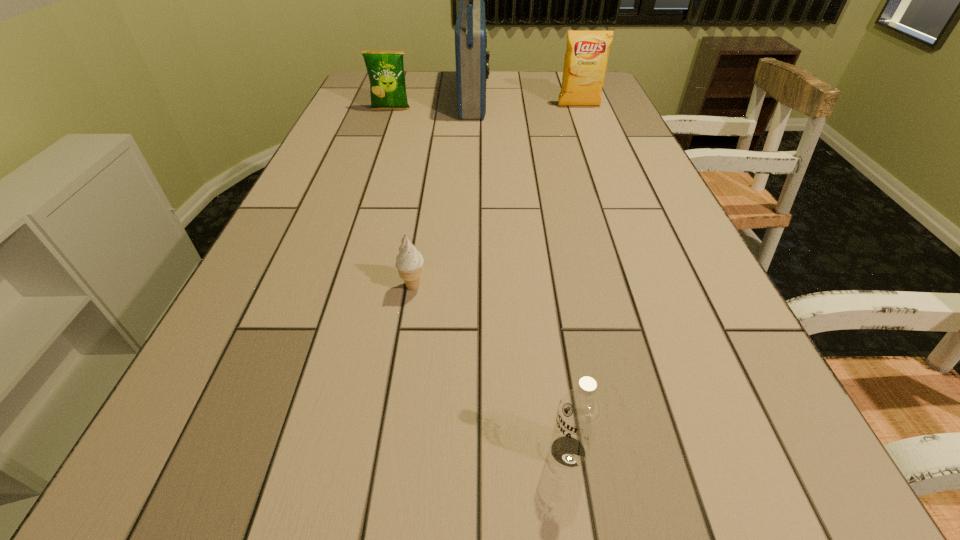
The height and width of the screenshot is (540, 960). Find the location of `empty space that is in between the leftmost object and the nearest object`. empty space that is in between the leftmost object and the nearest object is located at coordinates (479, 280).

What are the coordinates of `vacant space that's between the leftmost object and the third object from right to left` in the screenshot? It's located at (433, 104).

Select which object appears as the closest to the vodka. Please provide its 2D coordinates. Your answer should be formatted as a tuple, i.e. [(x, y)], where the tuple contains the x and y coordinates of a point satisfying the conditions above.

[(409, 262)]

This screenshot has width=960, height=540. I want to click on the closest object to the nearest object, so click(409, 262).

Where is `vacant space that satisfies the following two spatial constraints: 1. on the front panel of the radio receiver; 2. on the front-facing side of the leftmost object`? The width and height of the screenshot is (960, 540). vacant space that satisfies the following two spatial constraints: 1. on the front panel of the radio receiver; 2. on the front-facing side of the leftmost object is located at coordinates (474, 109).

Find the location of a particular element. The image size is (960, 540). vacant space that satisfies the following two spatial constraints: 1. on the front panel of the radio receiver; 2. on the front-facing side of the shortest object is located at coordinates (470, 287).

Identify the location of blank space that satisfies the following two spatial constraints: 1. on the front of the taller crisp (potato chip) with the logo; 2. on the front label of the second object from right to left. (713, 451).

In order to click on free spot that satisfies the following two spatial constraints: 1. on the front panel of the third object from right to left; 2. on the front-facing side of the left crisp (potato chip) in this screenshot , I will do `click(474, 109)`.